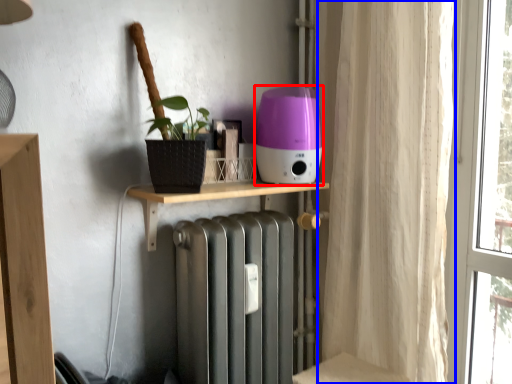
Question: Which object appears farthest to the camera in this image, appliance (highlighted by a red box) or curtain (highlighted by a blue box)?

Choices:
 (A) appliance
 (B) curtain

Answer: (A)